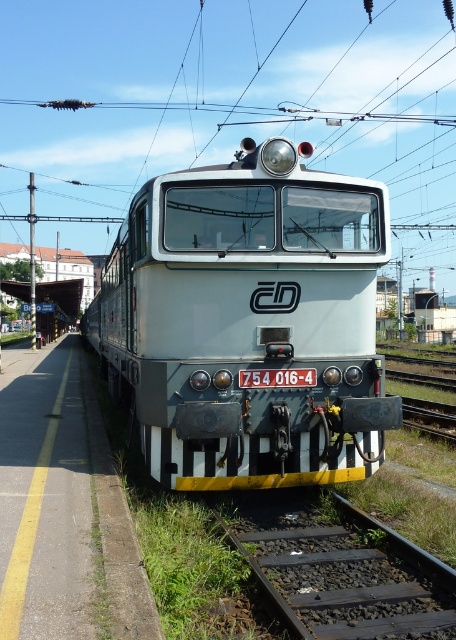
You are standing at the station platform and want to board the white glossy train at center. Where should you go to find the entrance?

The entrance to the white glossy train at center is located at its front section, which is facing the platform. Since the train is positioned at coordinates approximately 0.506 on the x and 0.546 on the y axis, you should approach the front of the train closest to the platform to find the entrance.

You are a maintenance worker inspecting the train and tracks. You need to know if the white glossy train at center can pass under a low bridge that is exactly the same height as the black metal train track at lower right. Can it?

The white glossy train at center is taller than the black metal train track at lower right. Since the bridge is the same height as the track, the train cannot pass under it without hitting the bridge.